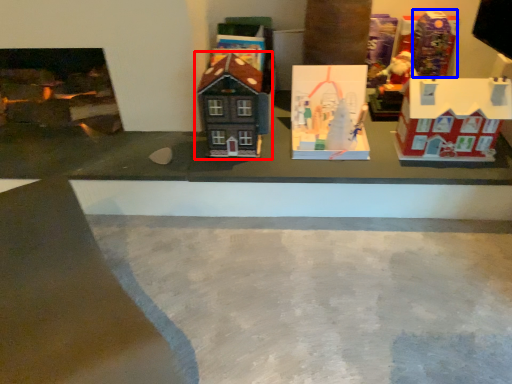
Question: Which object appears farthest to the camera in this image, toy (highlighted by a red box) or toy (highlighted by a blue box)?

Choices:
 (A) toy
 (B) toy

Answer: (B)